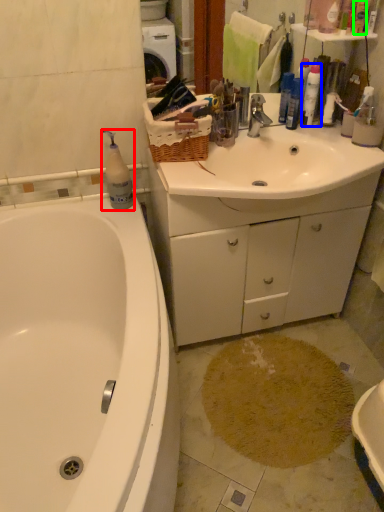
Question: Which object is the closest to the cleaning product (highlighted by a red box)? Choose among these: cleaning product (highlighted by a blue box) or toiletry (highlighted by a green box).

Choices:
 (A) cleaning product
 (B) toiletry

Answer: (A)